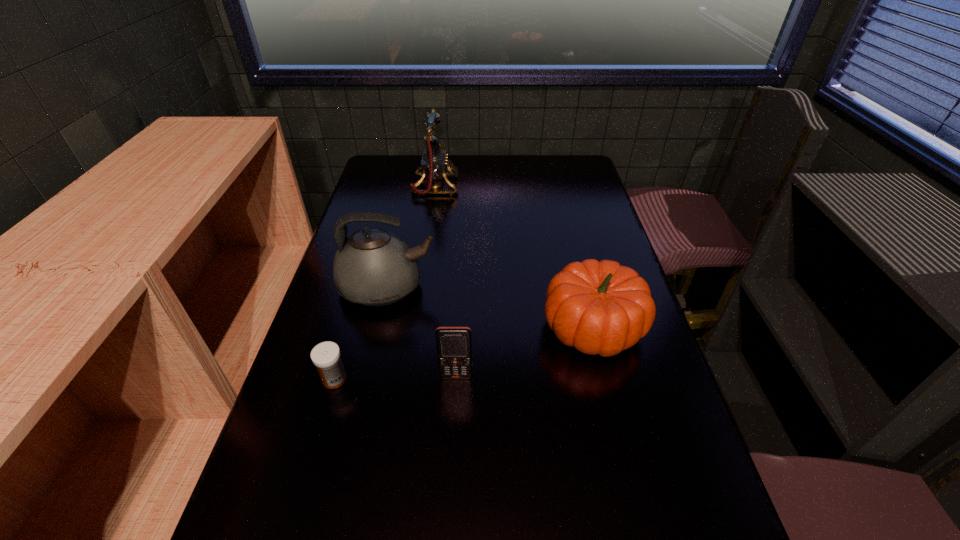
You are a GUI agent. You are given a task and a screenshot of the screen. Output one action in this format:
    pyautogui.click(x=<x>, y=<y>)
    Task: Click on the vacant space that satisfies the following two spatial constraints: 1. on the front of the rightmost object, featuring the rotary dial; 2. on the left side of the farthest object
    
    Given the screenshot: What is the action you would take?
    pyautogui.click(x=415, y=327)